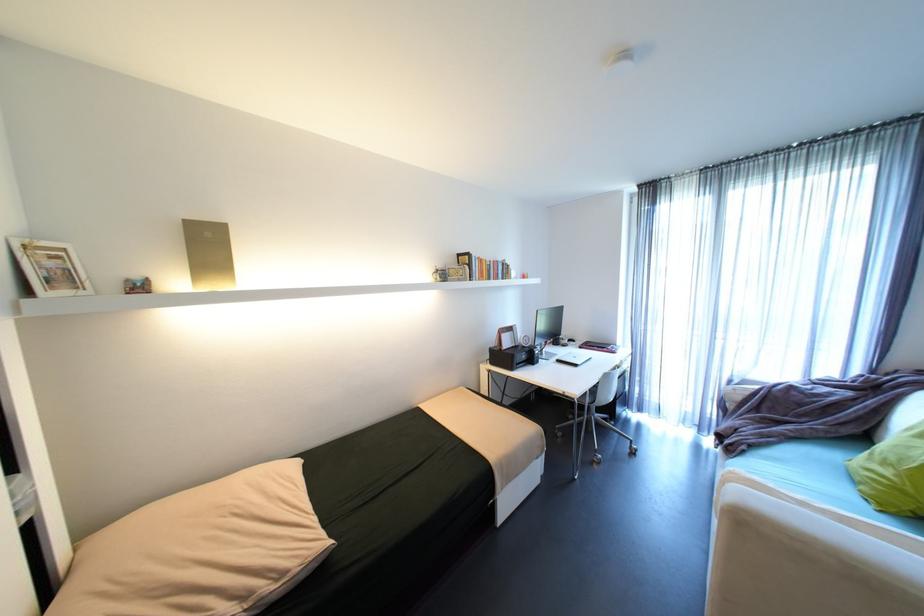
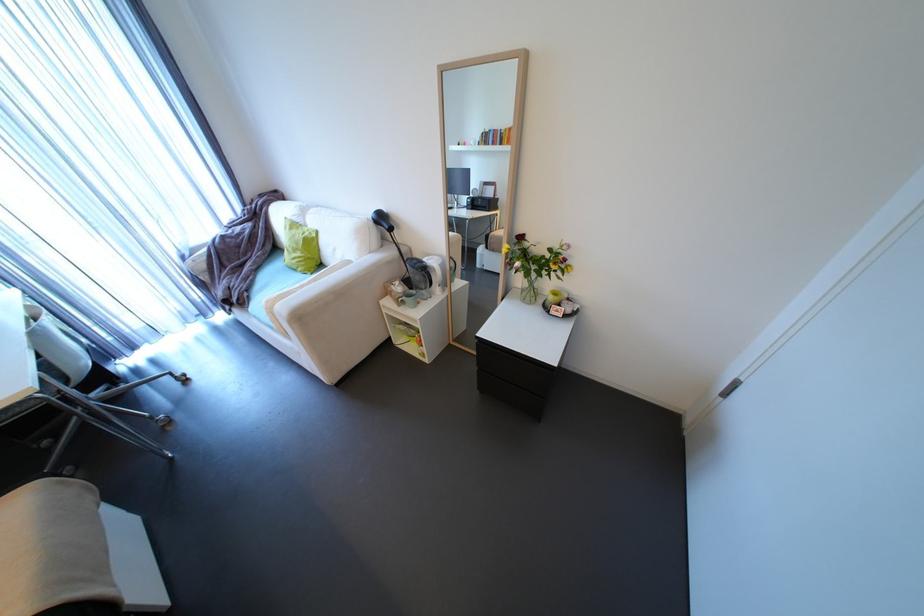
In the second image, find the point that corresponds to point 886,512 in the first image.

(319, 274)